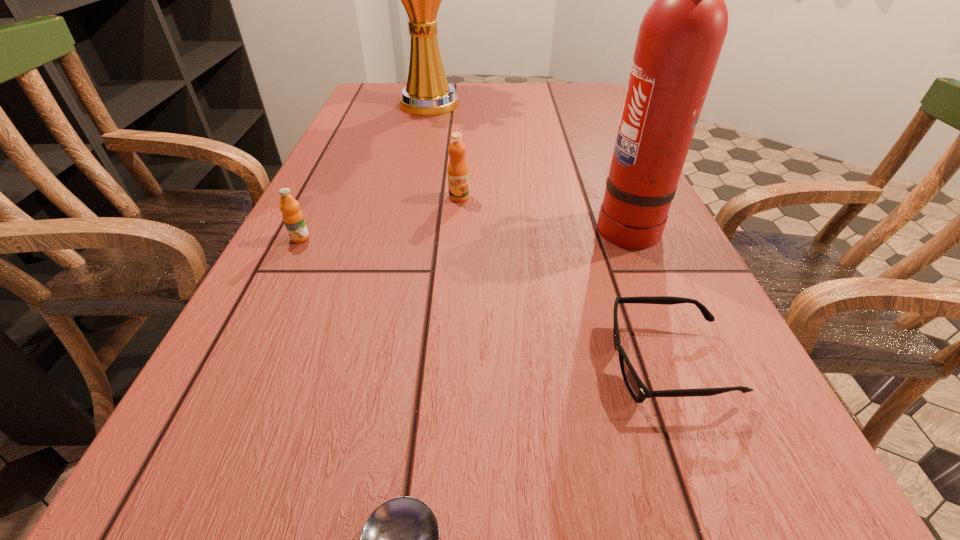
The height and width of the screenshot is (540, 960). I want to click on free region located on the label side of the second tallest object, so click(x=540, y=225).

Locate an element on the screen. This screenshot has width=960, height=540. free location located 0.390m on the label side of the second tallest object is located at coordinates (400, 225).

Where is `free space located on the label side of the second tallest object`? This screenshot has width=960, height=540. free space located on the label side of the second tallest object is located at coordinates (500, 225).

Where is `free space located 0.050m on the front label of the farther orange juice`? The height and width of the screenshot is (540, 960). free space located 0.050m on the front label of the farther orange juice is located at coordinates (458, 216).

At what (x,y) coordinates should I click in order to perform the action: click on blank space located 0.170m on the label of the nearer orange juice. Please return your answer as a coordinate pair (x, y). The image size is (960, 540). Looking at the image, I should click on (265, 308).

Identify the location of free spot located on the front-facing side of the second shortest object. (576, 364).

You are a GUI agent. You are given a task and a screenshot of the screen. Output one action in this format:
    pyautogui.click(x=<x>, y=<y>)
    Task: Click on the free spot located on the front-facing side of the second shortest object
    The image size is (960, 540).
    Given the screenshot: What is the action you would take?
    pyautogui.click(x=562, y=364)

Locate an element on the screen. The width and height of the screenshot is (960, 540). vacant space located 0.330m on the front-facing side of the second shortest object is located at coordinates (379, 364).

What are the coordinates of `object that is at the far edge` in the screenshot? It's located at (427, 93).

What are the coordinates of `trophy_cup that is at the left edge` in the screenshot? It's located at (427, 93).